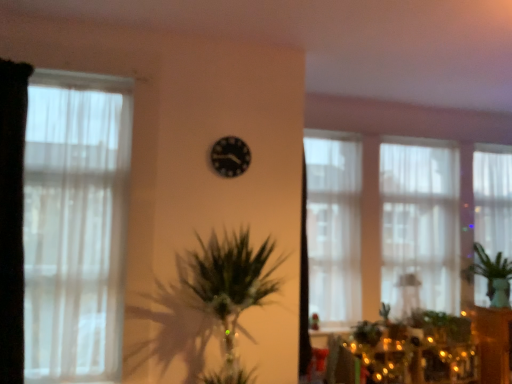
Question: Does translucent fabric window at center, which is the third window in front-to-back order, have a lesser width compared to white sheer curtain at left, the 4th window when ordered from back to front?

Choices:
 (A) no
 (B) yes

Answer: (A)

Question: Is translucent fabric window at center, which is the third window in front-to-back order, not near white sheer curtain at left, which is the first window in front-to-back order?

Choices:
 (A) no
 (B) yes

Answer: (B)

Question: Is translucent fabric window at center, the 2th window when ordered from back to front, to the right of white sheer curtain at left, the 1th window viewed from the left, from the viewer's perspective?

Choices:
 (A) yes
 (B) no

Answer: (A)

Question: Is translucent fabric window at center, positioned as the 2th window in right-to-left order, not inside white sheer curtain at left, the 4th window when ordered from back to front?

Choices:
 (A) yes
 (B) no

Answer: (A)

Question: Is translucent fabric window at center, the 2th window when ordered from back to front, turned away from white sheer curtain at left, the 4th window when ordered from back to front?

Choices:
 (A) yes
 (B) no

Answer: (B)

Question: From the image's perspective, is translucent fabric window at center, positioned as the 2th window in right-to-left order, below white sheer curtain at left, which is the first window in front-to-back order?

Choices:
 (A) no
 (B) yes

Answer: (B)

Question: From a real-world perspective, is translucent fabric window at center, positioned as the 2th window in right-to-left order, below black fabric curtain at left?

Choices:
 (A) no
 (B) yes

Answer: (B)

Question: Is translucent fabric window at center, which is the third window in front-to-back order, in front of black fabric curtain at left?

Choices:
 (A) yes
 (B) no

Answer: (B)

Question: Does translucent fabric window at center, positioned as the 2th window in right-to-left order, come behind black fabric curtain at left?

Choices:
 (A) yes
 (B) no

Answer: (A)

Question: Could black fabric curtain at left be considered to be inside translucent fabric window at center, the 3th window in the left-to-right sequence?

Choices:
 (A) yes
 (B) no

Answer: (B)

Question: Is translucent fabric window at center, which is the third window in front-to-back order, at the left side of black fabric curtain at left?

Choices:
 (A) yes
 (B) no

Answer: (B)

Question: Is translucent fabric window at center, the 3th window in the left-to-right sequence, at the right side of black fabric curtain at left?

Choices:
 (A) no
 (B) yes

Answer: (B)

Question: Does green leafy plant at right lie in front of black matte clock at center?

Choices:
 (A) no
 (B) yes

Answer: (A)